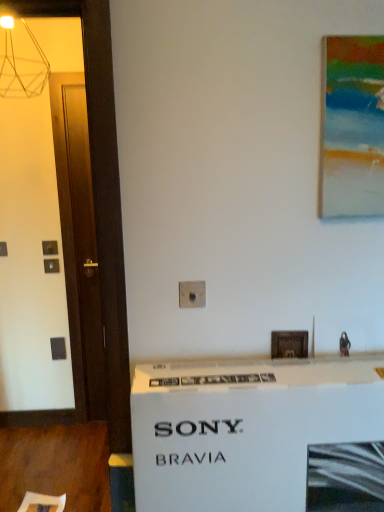
Question: In terms of size, does wooden picture frame at center, marked as the 1th picture frame in a back-to-front arrangement, appear bigger or smaller than white cardboard box at center?

Choices:
 (A) small
 (B) big

Answer: (A)

Question: In terms of width, does wooden picture frame at center, marked as the 1th picture frame in a back-to-front arrangement, look wider or thinner when compared to white cardboard box at center?

Choices:
 (A) wide
 (B) thin

Answer: (B)

Question: Estimate the real-world distances between objects in this image. Which object is farther from the white cardboard box at center?

Choices:
 (A) acrylic painting at upper right, which appears as the 2th picture frame when viewed from the back
 (B) wooden picture frame at center, placed as the first picture frame when sorted from left to right

Answer: (A)

Question: Which object is the closest to the acrylic painting at upper right, which appears as the 2th picture frame when viewed from the back?

Choices:
 (A) white cardboard box at center
 (B) wooden picture frame at center, placed as the first picture frame when sorted from left to right

Answer: (B)